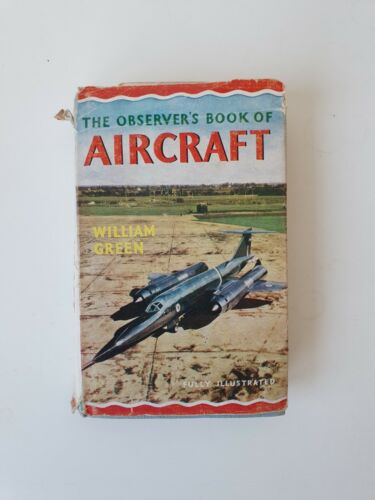
Identify the location of 1 white wall. point(326,185).